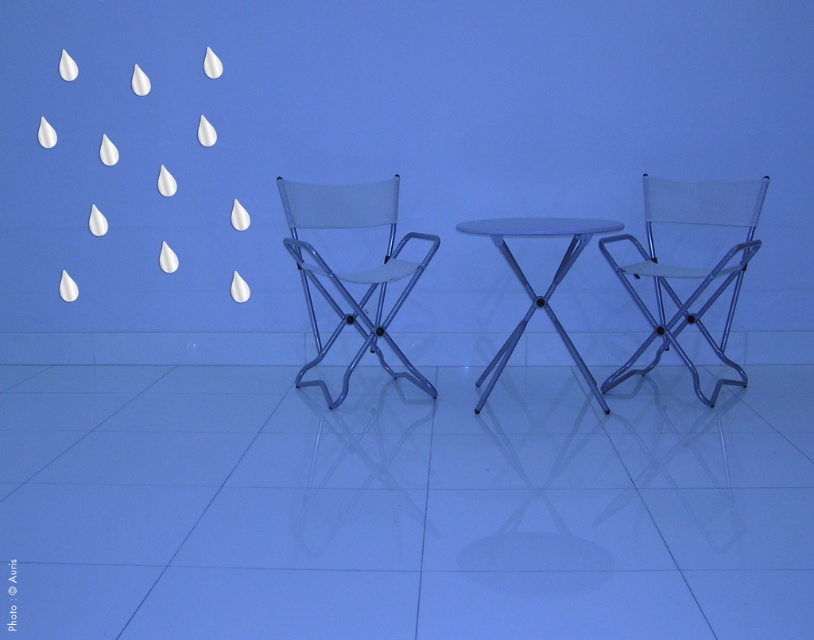
You are planning to seat two guests in the space shown. You have a 1.5 meter wide sofa that you want to place between the translucent plastic chair at right and the white fabric chair at center. Will there be enough space between them to fit the sofa?

The translucent plastic chair at right is smaller than the white fabric chair at center, but the exact distance between them isn not specified in the provided information. Without knowing the actual spacing between the two chairs, it is impossible to determine if the 1.5 meter wide sofa will fit.